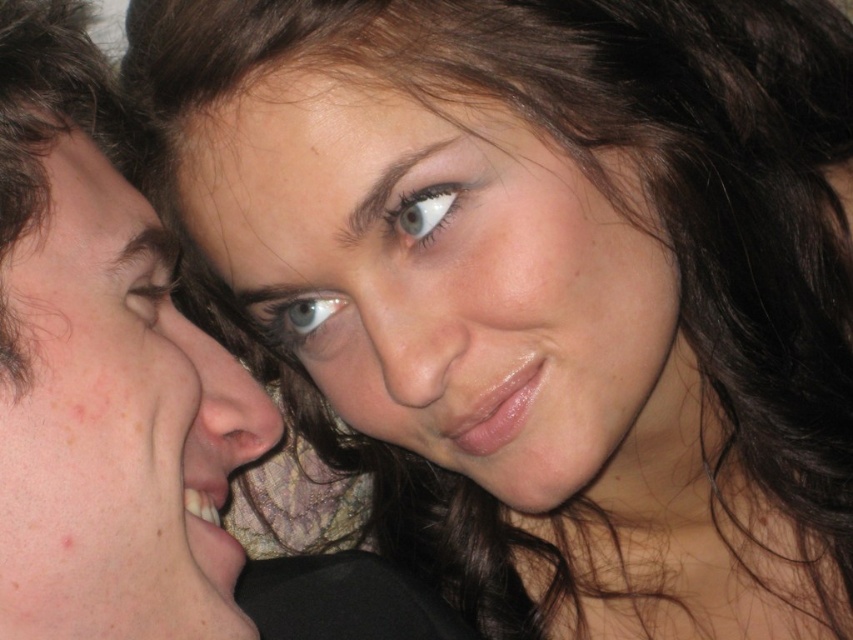
Question: Among these objects, which one is nearest to the camera?

Choices:
 (A) blue glossy eye at center
 (B) brown hair at upper left

Answer: (B)

Question: Can you confirm if smooth skin nose at center is positioned above blue matte eye at upper left?

Choices:
 (A) no
 (B) yes

Answer: (A)

Question: Can you confirm if smooth skin nose at center is thinner than brown matte eyebrow at upper center?

Choices:
 (A) no
 (B) yes

Answer: (A)

Question: Which point is farther to the camera?

Choices:
 (A) (439, 330)
 (B) (358, 220)
 (C) (169, 264)

Answer: (C)

Question: Does smooth skin face at center appear on the right side of blue glossy eye at center?

Choices:
 (A) yes
 (B) no

Answer: (A)

Question: Which point is closer to the camera taking this photo?

Choices:
 (A) (117, 269)
 (B) (47, 564)
 (C) (381, 316)

Answer: (B)